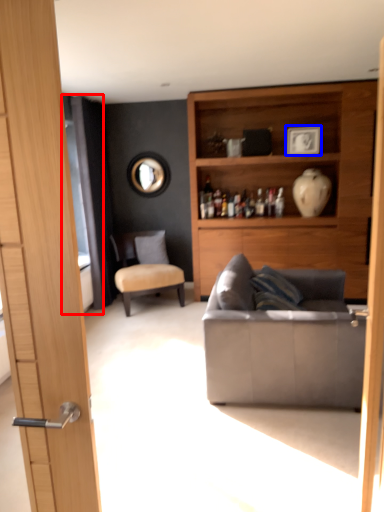
Question: Which object appears farthest to the camera in this image, screen door (highlighted by a red box) or picture frame (highlighted by a blue box)?

Choices:
 (A) screen door
 (B) picture frame

Answer: (B)